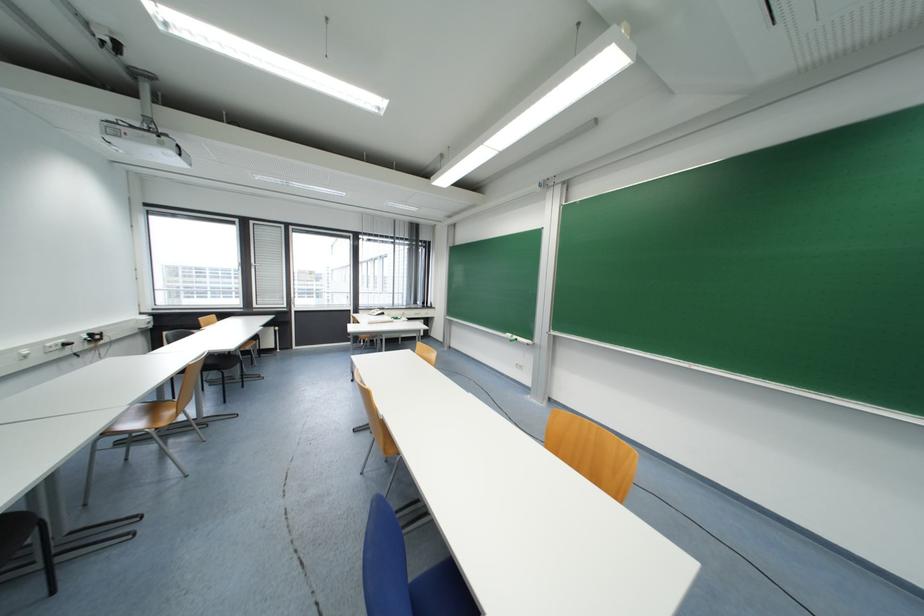
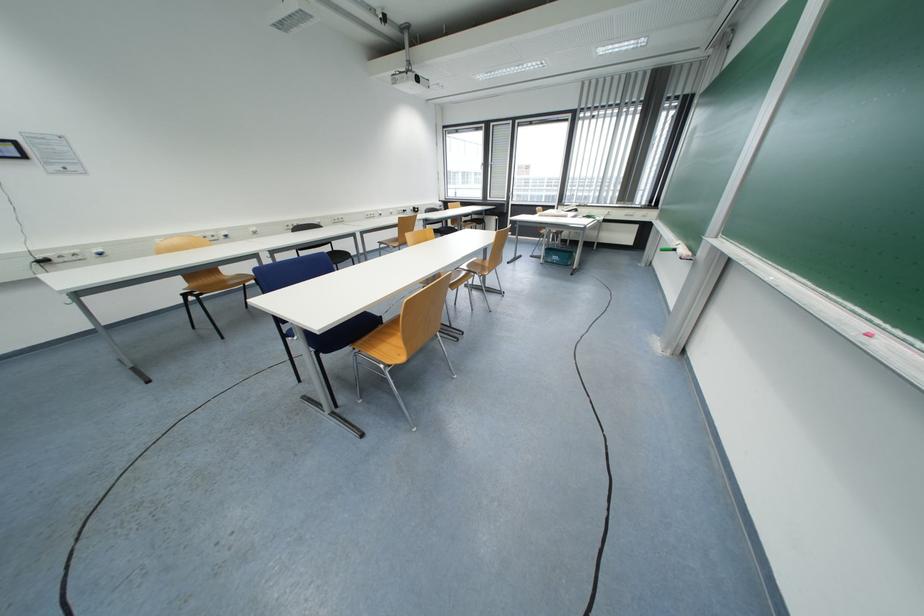
Locate, in the second image, the point that corresponds to pixel 515 336 in the first image.

(683, 244)